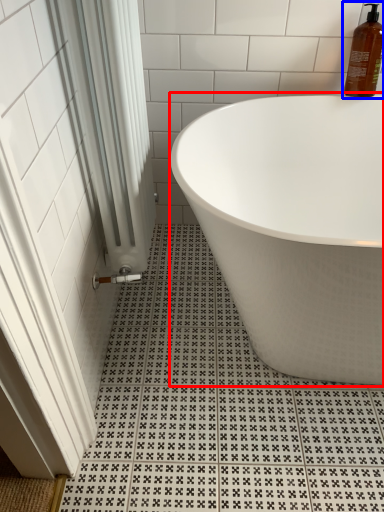
Question: Which object appears closest to the camera in this image, bathtub (highlighted by a red box) or cleaning product (highlighted by a blue box)?

Choices:
 (A) bathtub
 (B) cleaning product

Answer: (A)